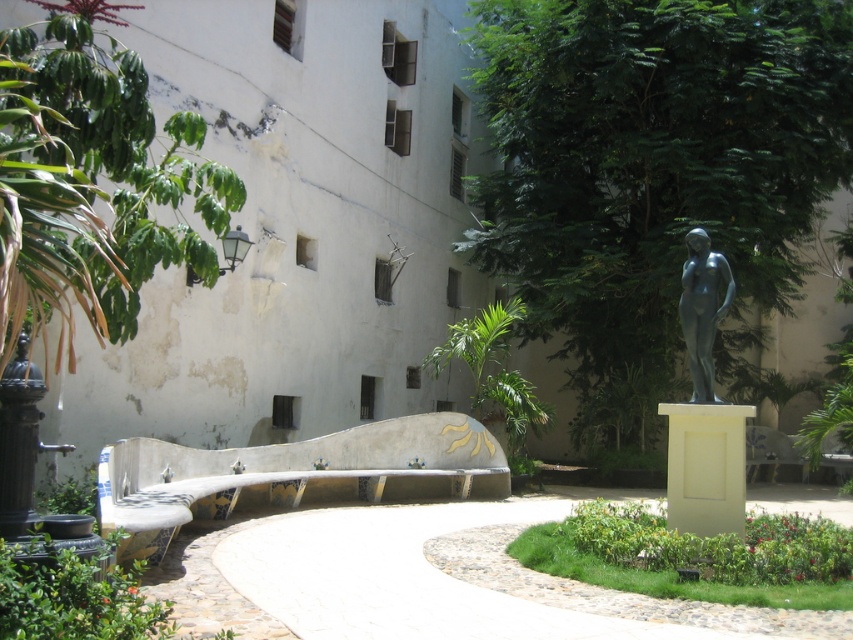
Is green leafy tree at center taller than green leafy plant at upper left?

No, green leafy tree at center is not taller than green leafy plant at upper left.

Can you confirm if green leafy tree at center is positioned to the right of green leafy plant at upper left?

Indeed, green leafy tree at center is positioned on the right side of green leafy plant at upper left.

Identify the location of green leafy tree at center. Image resolution: width=853 pixels, height=640 pixels. (653, 168).

Which is in front, point (585, 1) or point (714, 314)?

Point (714, 314)

Measure the distance between green leafy tree at center and metallic statue at center-right.

green leafy tree at center and metallic statue at center-right are 8.10 meters apart.

Image resolution: width=853 pixels, height=640 pixels. Describe the element at coordinates (653, 168) in the screenshot. I see `green leafy tree at center` at that location.

The width and height of the screenshot is (853, 640). In order to click on green leafy tree at center in this screenshot , I will do `click(653, 168)`.

Is green leafy plant at upper left above green grass at center?

Correct, green leafy plant at upper left is located above green grass at center.

Does green leafy plant at upper left appear on the right side of green grass at center?

Incorrect, green leafy plant at upper left is not on the right side of green grass at center.

You are a GUI agent. You are given a task and a screenshot of the screen. Output one action in this format:
    pyautogui.click(x=<x>, y=<y>)
    Task: Click on the green leafy plant at upper left
    The width and height of the screenshot is (853, 640).
    Given the screenshot: What is the action you would take?
    pyautogui.click(x=91, y=180)